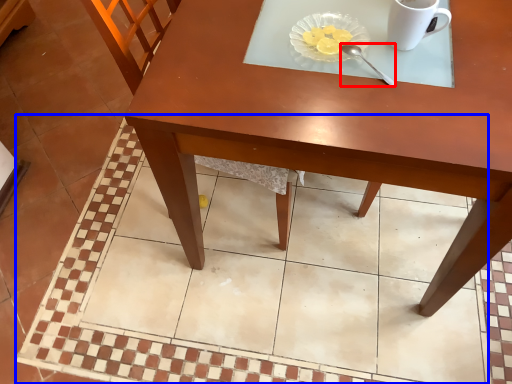
Question: Which of the following is the farthest to the observer, spoon (highlighted by a red box) or square (highlighted by a blue box)?

Choices:
 (A) spoon
 (B) square

Answer: (B)